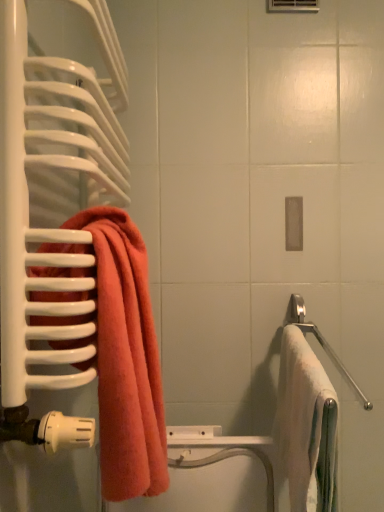
Where is `white soft towel at right, the first towel from the right`? The image size is (384, 512). white soft towel at right, the first towel from the right is located at coordinates (306, 423).

From the picture: What is the approximate height of satin silver towel bar at right?

satin silver towel bar at right is 14.07 centimeters in height.

Where is `coral terry towel at left, arranged as the first towel when viewed from the left`? This screenshot has width=384, height=512. coral terry towel at left, arranged as the first towel when viewed from the left is located at coordinates (116, 350).

Between coral terry towel at left, the 2th towel in the right-to-left sequence, and white soft towel at right, the first towel from the right, which one appears on the left side from the viewer's perspective?

coral terry towel at left, the 2th towel in the right-to-left sequence, is more to the left.

Where is `towel that appears behind the coral terry towel at left, the 2th towel in the right-to-left sequence`? towel that appears behind the coral terry towel at left, the 2th towel in the right-to-left sequence is located at coordinates (306, 423).

Can you tell me how much coral terry towel at left, arranged as the first towel when viewed from the left, and white soft towel at right, the first towel from the right, differ in facing direction?

The facing directions of coral terry towel at left, arranged as the first towel when viewed from the left, and white soft towel at right, the first towel from the right, are 2.2e-05 degrees apart.

Is coral terry towel at left, arranged as the first towel when viewed from the left, not within white soft towel at right, which is the second towel in left-to-right order?

Indeed, coral terry towel at left, arranged as the first towel when viewed from the left, is completely outside white soft towel at right, which is the second towel in left-to-right order.

In terms of size, does satin silver towel bar at right appear bigger or smaller than coral terry towel at left, the 2th towel in the right-to-left sequence?

satin silver towel bar at right is smaller than coral terry towel at left, the 2th towel in the right-to-left sequence.

Is satin silver towel bar at right oriented towards coral terry towel at left, the 2th towel in the right-to-left sequence?

No, satin silver towel bar at right is not oriented towards coral terry towel at left, the 2th towel in the right-to-left sequence.

From the satin silver towel bar at right, count 2nd towels forward and point to it. Please provide its 2D coordinates.

[(116, 350)]

Which is more to the right, satin silver towel bar at right or coral terry towel at left, the 2th towel in the right-to-left sequence?

satin silver towel bar at right is more to the right.

Is white soft towel at right, which is the second towel in left-to-right order, far from satin silver towel bar at right?

No.

How much distance is there between white soft towel at right, which is the second towel in left-to-right order, and satin silver towel bar at right?

11.36 inches.

Is white soft towel at right, the first towel from the right, oriented towards satin silver towel bar at right?

No, white soft towel at right, the first towel from the right, is not aimed at satin silver towel bar at right.

Consider the image. From the image's perspective, which one is positioned higher, white soft towel at right, the first towel from the right, or satin silver towel bar at right?

satin silver towel bar at right is shown above in the image.

What's the angular difference between white soft towel at right, which is the second towel in left-to-right order, and coral terry towel at left, arranged as the first towel when viewed from the left,'s facing directions?

The facing directions of white soft towel at right, which is the second towel in left-to-right order, and coral terry towel at left, arranged as the first towel when viewed from the left, are 2.2e-05 degrees apart.

The image size is (384, 512). In order to click on towel lying behind the coral terry towel at left, arranged as the first towel when viewed from the left in this screenshot , I will do `click(306, 423)`.

Which object is thinner, white soft towel at right, which is the second towel in left-to-right order, or coral terry towel at left, the 2th towel in the right-to-left sequence?

coral terry towel at left, the 2th towel in the right-to-left sequence, is thinner.

Between white soft towel at right, which is the second towel in left-to-right order, and coral terry towel at left, the 2th towel in the right-to-left sequence, which one has larger size?

Bigger between the two is white soft towel at right, which is the second towel in left-to-right order.

In terms of size, does coral terry towel at left, the 2th towel in the right-to-left sequence, appear bigger or smaller than satin silver towel bar at right?

Clearly, coral terry towel at left, the 2th towel in the right-to-left sequence, is larger in size than satin silver towel bar at right.

Which is less distant, (156, 402) or (364, 401)?

Point (156, 402).

Which is more to the left, coral terry towel at left, arranged as the first towel when viewed from the left, or satin silver towel bar at right?

coral terry towel at left, arranged as the first towel when viewed from the left.

Considering the relative positions of satin silver towel bar at right and white soft towel at right, which is the second towel in left-to-right order, in the image provided, is satin silver towel bar at right to the left or to the right of white soft towel at right, which is the second towel in left-to-right order,?

Clearly, satin silver towel bar at right is on the right of white soft towel at right, which is the second towel in left-to-right order, in the image.

Is satin silver towel bar at right far from white soft towel at right, the first towel from the right?

satin silver towel bar at right is actually quite close to white soft towel at right, the first towel from the right.

Can white soft towel at right, the first towel from the right, be found inside satin silver towel bar at right?

That's incorrect, white soft towel at right, the first towel from the right, is not inside satin silver towel bar at right.

Is point (353, 381) positioned behind point (316, 392)?

Yes, it is behind point (316, 392).

You are a GUI agent. You are given a task and a screenshot of the screen. Output one action in this format:
    pyautogui.click(x=<x>, y=<y>)
    Task: Click on the towel lying behind the coral terry towel at left, the 2th towel in the right-to-left sequence
    The height and width of the screenshot is (512, 384).
    Given the screenshot: What is the action you would take?
    pyautogui.click(x=306, y=423)

Which towel is the 2nd one when counting from the left side of the satin silver towel bar at right? Please provide its 2D coordinates.

[(116, 350)]

Looking at the image, which one is located closer to white soft towel at right, which is the second towel in left-to-right order, coral terry towel at left, the 2th towel in the right-to-left sequence, or satin silver towel bar at right?

satin silver towel bar at right lies closer to white soft towel at right, which is the second towel in left-to-right order, than the other object.

When comparing their distances from satin silver towel bar at right, does white soft towel at right, which is the second towel in left-to-right order, or coral terry towel at left, the 2th towel in the right-to-left sequence, seem closer?

Based on the image, white soft towel at right, which is the second towel in left-to-right order, appears to be nearer to satin silver towel bar at right.

Looking at the image, which one is located further to white soft towel at right, which is the second towel in left-to-right order, satin silver towel bar at right or coral terry towel at left, arranged as the first towel when viewed from the left?

Among the two, coral terry towel at left, arranged as the first towel when viewed from the left, is located further to white soft towel at right, which is the second towel in left-to-right order.

Looking at the image, which one is located further to coral terry towel at left, the 2th towel in the right-to-left sequence, white soft towel at right, the first towel from the right, or satin silver towel bar at right?

satin silver towel bar at right is further to coral terry towel at left, the 2th towel in the right-to-left sequence.

From the image, which object appears to be nearer to satin silver towel bar at right, coral terry towel at left, arranged as the first towel when viewed from the left, or white soft towel at right, which is the second towel in left-to-right order?

white soft towel at right, which is the second towel in left-to-right order, lies closer to satin silver towel bar at right than the other object.

When comparing their distances from coral terry towel at left, arranged as the first towel when viewed from the left, does satin silver towel bar at right or white soft towel at right, the first towel from the right, seem closer?

The object closer to coral terry towel at left, arranged as the first towel when viewed from the left, is white soft towel at right, the first towel from the right.

You are a GUI agent. You are given a task and a screenshot of the screen. Output one action in this format:
    pyautogui.click(x=<x>, y=<y>)
    Task: Click on the towel situated between coral terry towel at left, arranged as the first towel when viewed from the left, and satin silver towel bar at right from left to right
    The image size is (384, 512).
    Given the screenshot: What is the action you would take?
    pyautogui.click(x=306, y=423)